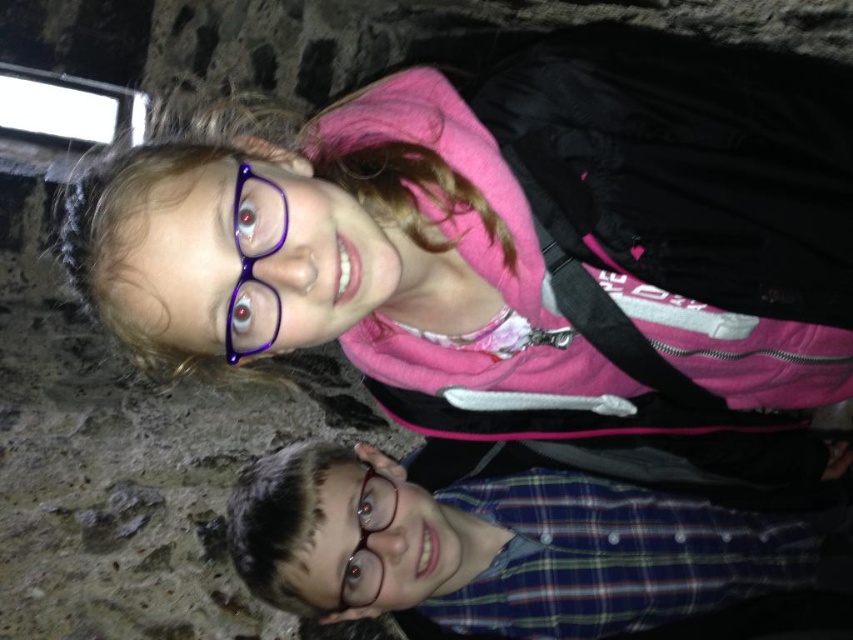
Question: Is matte pink jacket at upper center smaller than plaid fabric shirt at lower right?

Choices:
 (A) no
 (B) yes

Answer: (A)

Question: Which of the following is the closest to the observer?

Choices:
 (A) (300, 522)
 (B) (200, 225)
 (C) (238, 292)

Answer: (B)

Question: Which point is closer to the camera taking this photo?

Choices:
 (A) (254, 177)
 (B) (525, 241)
 (C) (537, 516)

Answer: (A)

Question: Where is matte pink jacket at upper center located in relation to plaid fabric shirt at lower right in the image?

Choices:
 (A) right
 (B) left

Answer: (A)

Question: Can you confirm if matte pink jacket at upper center is thinner than plaid fabric shirt at lower right?

Choices:
 (A) no
 (B) yes

Answer: (A)

Question: Which object appears farthest from the camera in this image?

Choices:
 (A) purple plastic glasses at upper center
 (B) plaid fabric shirt at lower right

Answer: (B)